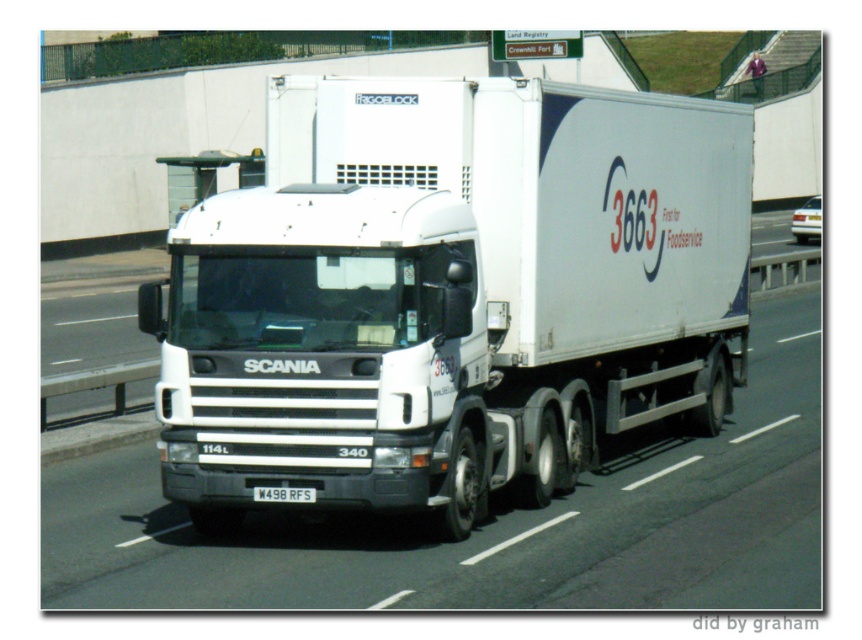
You are a traffic officer observing a white matte truck at center and a white plastic license plate at center. Which object is positioned more to the right?

The white plastic license plate at center is positioned more to the right than the white matte truck at center.

You are a pedestrian standing on the sidewalk and see the white matte truck at center and the white plastic license plate at center. Which object is closer to you?

The white matte truck at center is closer to you because the white plastic license plate at center is behind it.